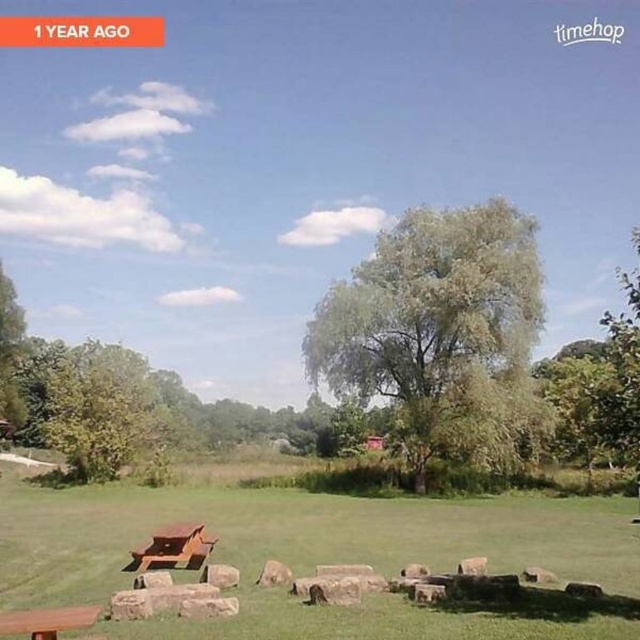
Based on the photo, you are planning to set up a small tent in the green grassy field at center and want to place a picnic basket on the gray rough stone at center. If the tent requires a minimum of 5 meters of space between it and the picnic basket for safety reasons, is this arrangement feasible?

The green grassy field at center and gray rough stone at center are 7.23 meters apart from each other, which exceeds the required 5 meters of safety distance. Therefore, this arrangement is feasible.

You are planning to set up a small picnic and need to choose between the wooden park bench at lower left and the smooth gray rock at center for placing your basket. Which surface has a larger surface area to accommodate your items?

The wooden park bench at lower left might be wider than smooth gray rock at center, so it likely has a larger surface area to accommodate your items.

You are standing at the picnic table and want to walk directly towards the green leafy tree at center. Which direction should you walk?

Since the green leafy tree at center is located at point (x=440, y=332), you should walk towards the center of the image to reach it.